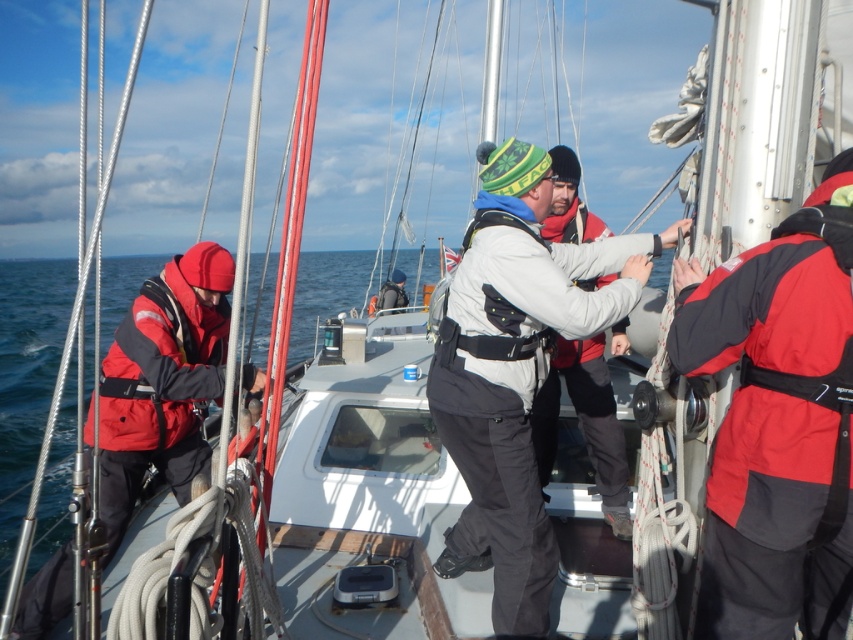
Does red matte jacket at left have a greater width compared to red softshell jacket at left?

Yes.

Does point (160, 333) come farther from viewer compared to point (131, 340)?

Yes, it is behind point (131, 340).

Identify the location of red matte jacket at left. [x=161, y=381].

Locate an element on the screen. white fleece jacket at center is located at coordinates pos(515,369).

Between point (538, 550) and point (160, 305), which one is positioned in front?

Positioned in front is point (538, 550).

Locate an element on the screen. The width and height of the screenshot is (853, 640). white fleece jacket at center is located at coordinates (515, 369).

Locate an element on the screen. Image resolution: width=853 pixels, height=640 pixels. white fleece jacket at center is located at coordinates (515, 369).

Who is shorter, white fleece jacket at center or red/black neoprene life jacket at right?

red/black neoprene life jacket at right

Image resolution: width=853 pixels, height=640 pixels. What do you see at coordinates (515, 369) in the screenshot?
I see `white fleece jacket at center` at bounding box center [515, 369].

At what (x,y) coordinates should I click in order to perform the action: click on white fleece jacket at center. Please return your answer as a coordinate pair (x, y). Image resolution: width=853 pixels, height=640 pixels. Looking at the image, I should click on (515, 369).